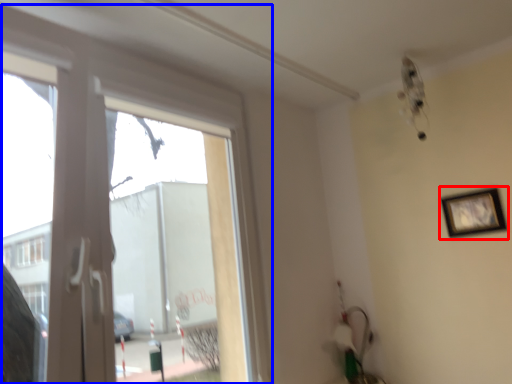
Question: Which object appears farthest to the camera in this image, picture frame (highlighted by a red box) or window (highlighted by a blue box)?

Choices:
 (A) picture frame
 (B) window

Answer: (A)